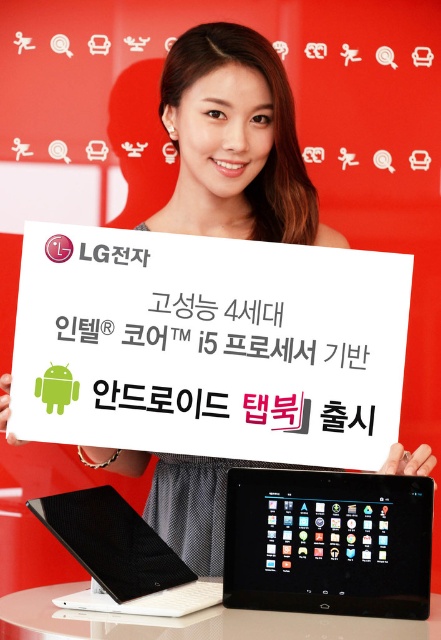
Based on the photo, you are at an electronics store and see the white paper at center and the black carbon fiber tablet at lower center. Which object is closer to you?

The white paper at center is closer to you because the black carbon fiber tablet at lower center is behind it.